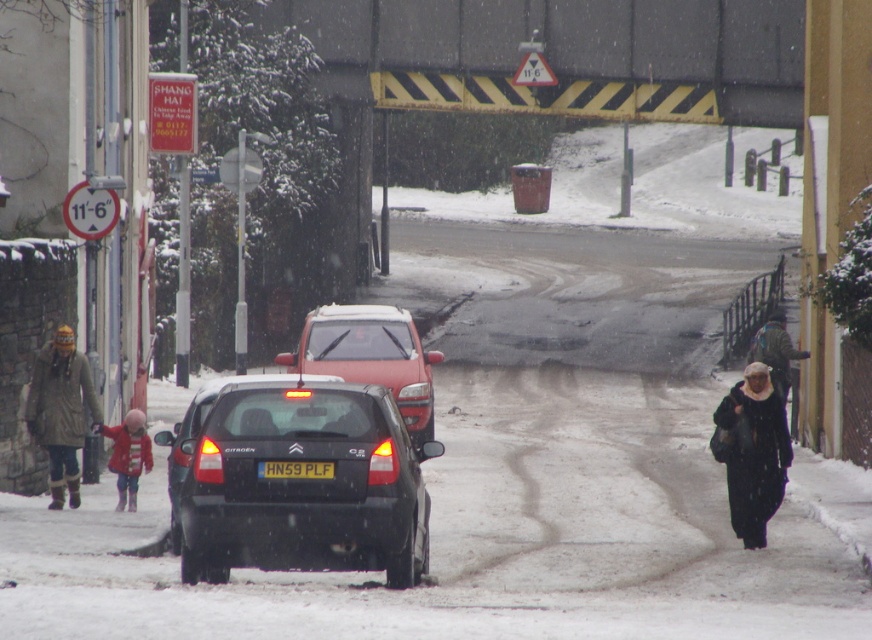
Question: Can you confirm if dark gray woolen coat at right is positioned to the left of yellow matte license plate at center?

Choices:
 (A) yes
 (B) no

Answer: (B)

Question: Is black matte car at center to the left of matte red van at center from the viewer's perspective?

Choices:
 (A) no
 (B) yes

Answer: (A)

Question: Which point appears closest to the camera in this image?

Choices:
 (A) (271, 476)
 (B) (315, 493)
 (C) (284, 362)

Answer: (B)

Question: Estimate the real-world distances between objects in this image. Which object is closer to the black matte car at center?

Choices:
 (A) green wool coat at left
 (B) dark gray coat at lower right

Answer: (A)

Question: Where is dark gray coat at lower right located in relation to yellow matte license plate at center in the image?

Choices:
 (A) above
 (B) below

Answer: (A)

Question: Which is farther from the red fleece jacket at lower left?

Choices:
 (A) black matte car at center
 (B) matte red van at center
 (C) dark gray coat at lower right

Answer: (C)